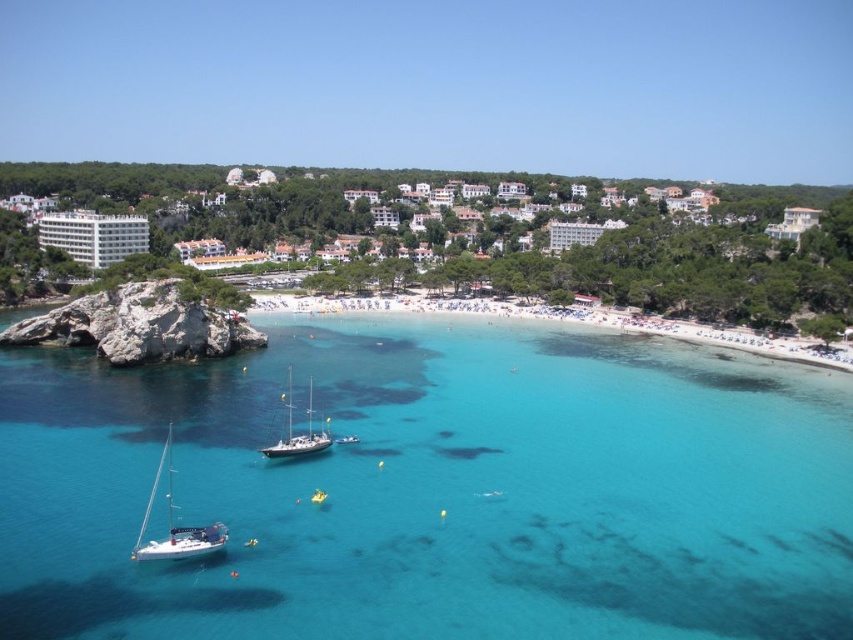
Can you confirm if white sand beach at center is positioned below white glossy sailboat at lower left?

No, white sand beach at center is not below white glossy sailboat at lower left.

Between white sand beach at center and white glossy sailboat at lower left, which one appears on the right side from the viewer's perspective?

Positioned to the right is white sand beach at center.

Is point (366, 307) less distant than point (165, 536)?

No, it is behind (165, 536).

Find the location of a particular element. The height and width of the screenshot is (640, 853). white sand beach at center is located at coordinates (567, 321).

Is white sand beach at center thinner than white glossy sailboat at center?

Incorrect, white sand beach at center's width is not less than white glossy sailboat at center's.

Who is more distant from viewer, (618, 317) or (311, 445)?

The point (618, 317) is more distant.

Identify the location of white sand beach at center. (567, 321).

Locate an element on the screen. The image size is (853, 640). white sand beach at center is located at coordinates (567, 321).

Describe the element at coordinates (434, 490) in the screenshot. I see `clear blue water at center` at that location.

Is point (363, 602) in front of point (161, 461)?

That is True.

Is point (399, 449) positioned after point (178, 552)?

That is True.

This screenshot has height=640, width=853. Identify the location of clear blue water at center. (434, 490).